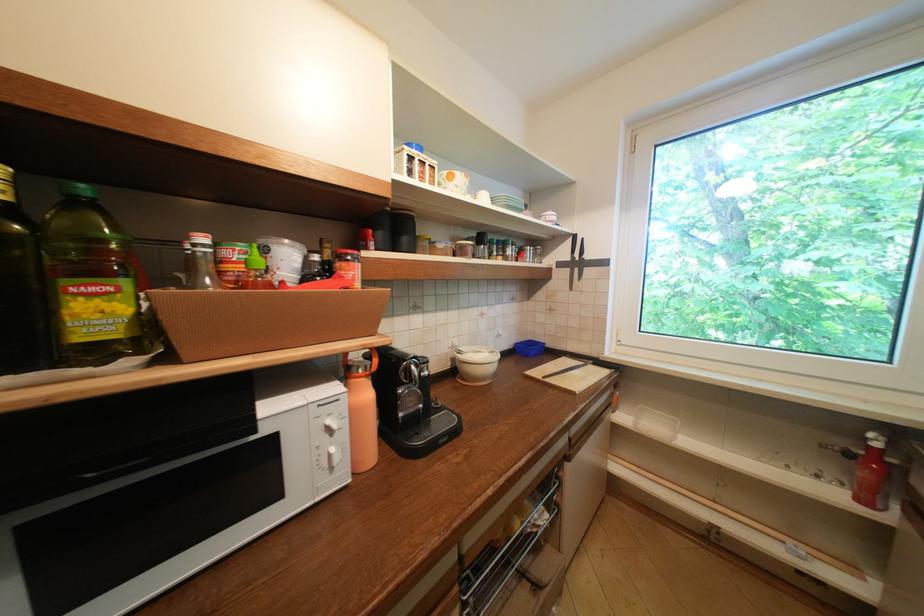
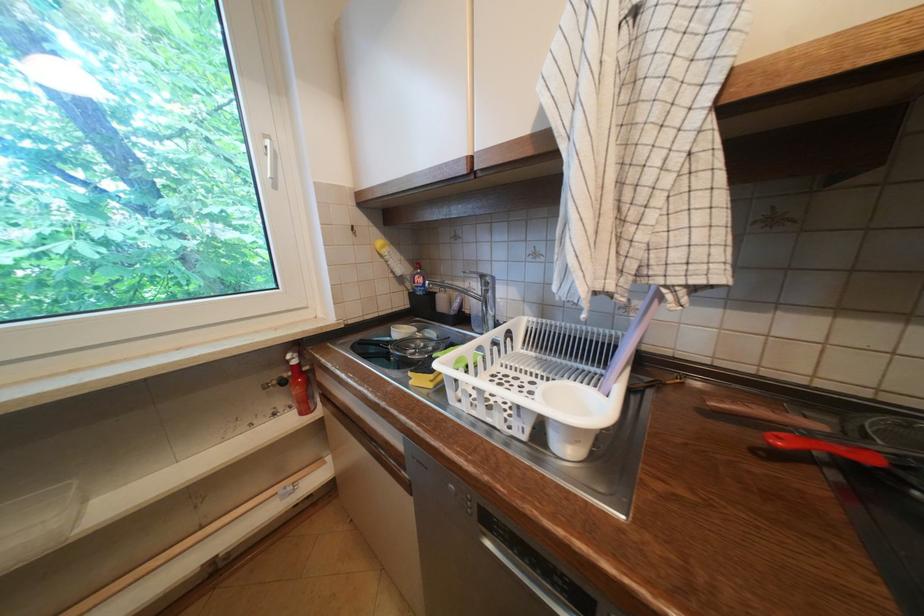
Where in the second image is the point corresponding to [874,440] from the first image?

(296, 362)